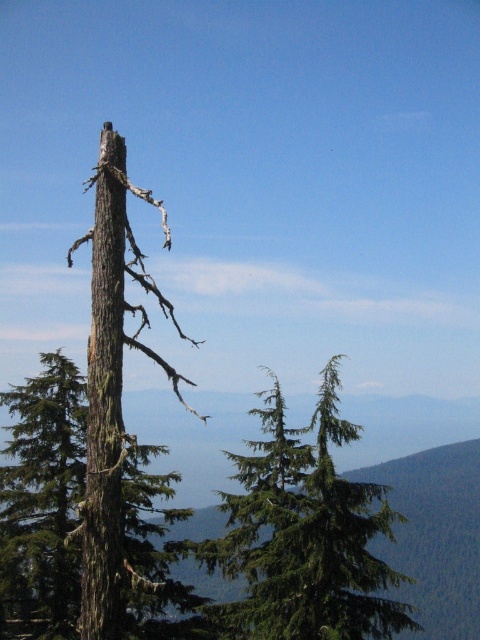
Question: Can you confirm if green needle-like tree at center is positioned above brown rough bark tree at center?

Choices:
 (A) no
 (B) yes

Answer: (A)

Question: Does brown rough bark tree at left lie behind brown rough bark tree trunk at left?

Choices:
 (A) no
 (B) yes

Answer: (A)

Question: Estimate the real-world distances between objects in this image. Which object is farther from the brown rough bark tree at left?

Choices:
 (A) green needle-like tree at center
 (B) brown rough bark tree trunk at left
 (C) brown rough bark tree at center

Answer: (A)

Question: Considering the real-world distances, which object is farthest from the brown rough bark tree at left?

Choices:
 (A) brown rough bark tree at center
 (B) green needle-like tree at center
 (C) brown rough bark tree trunk at left

Answer: (B)

Question: Does green needle-like tree at center appear over brown rough bark tree at left?

Choices:
 (A) yes
 (B) no

Answer: (B)

Question: Which object appears farthest from the camera in this image?

Choices:
 (A) brown rough bark tree trunk at left
 (B) brown rough bark tree at center
 (C) brown rough bark tree at left
 (D) green needle-like tree at center

Answer: (D)